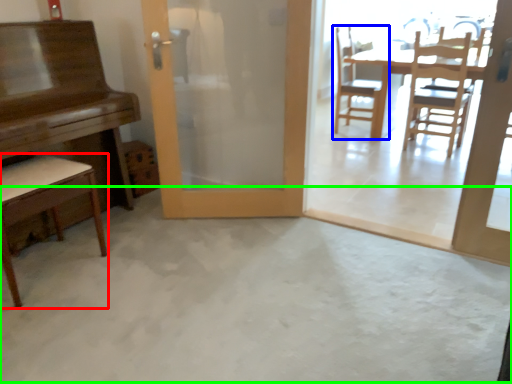
Question: Based on their relative distances, which object is farther from chair (highlighted by a red box)? Choose from chair (highlighted by a blue box) and concrete (highlighted by a green box).

Choices:
 (A) chair
 (B) concrete

Answer: (A)